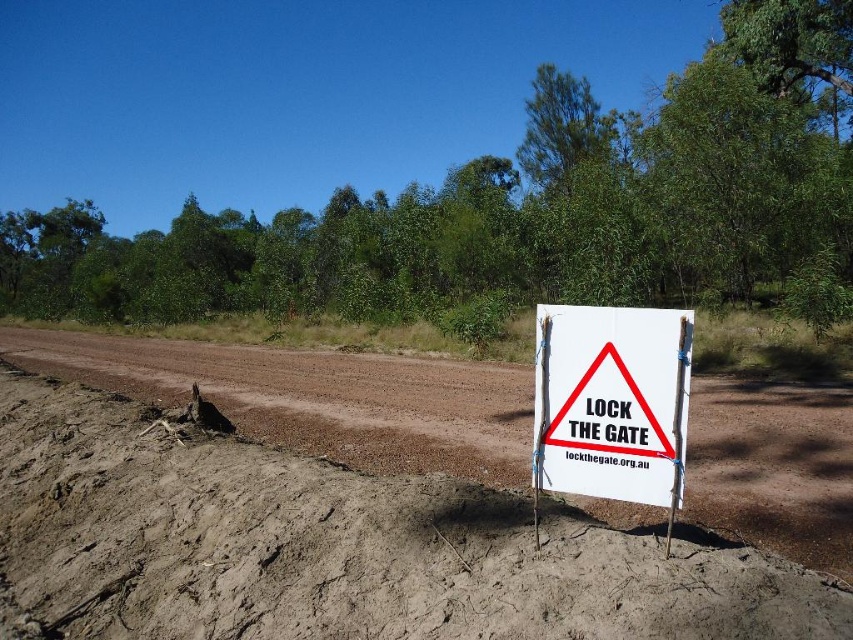
Is point (305, 497) farther from camera compared to point (532, 442)?

Yes, it is.

Is point (575, 592) in front of point (564, 310)?

Yes.

I want to click on brown dirt at center, so click(337, 547).